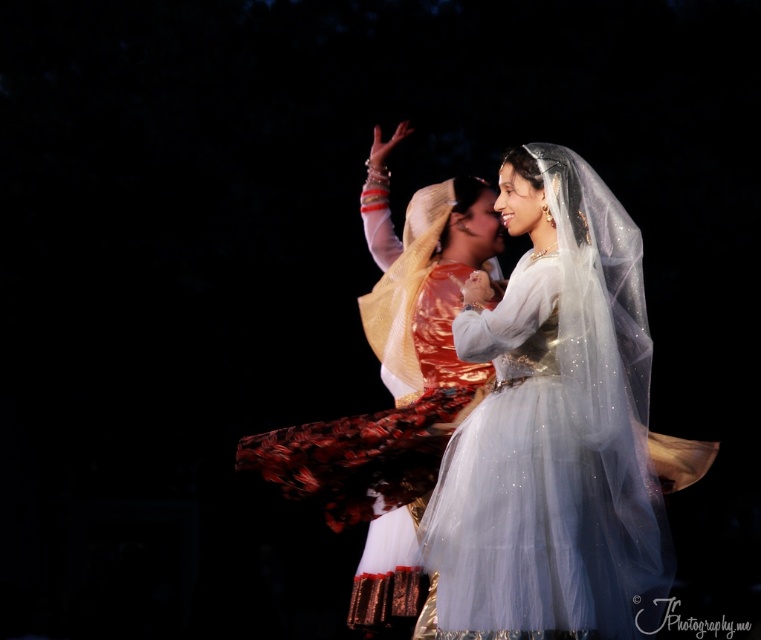
You are a photographer standing at the back of the stage. You want to take a photo of the silvery tulle dress at center and the matte gold veil at center so that both are in focus. The camera you are using has a depth of field that can cover 1.5 meters. Will both objects be in focus in the photo?

The silvery tulle dress at center and matte gold veil at center are 1.42 meters apart. Since the camera has a depth of field of 1.5 meters, which is greater than the distance between them, both objects will be in focus in the photo.

You are a photographer capturing the dancers on stage. You notice the silvery tulle dress at center and the matte gold veil at center. Which object is positioned to the right side of the other?

The silvery tulle dress at center is to the right of the matte gold veil at center.